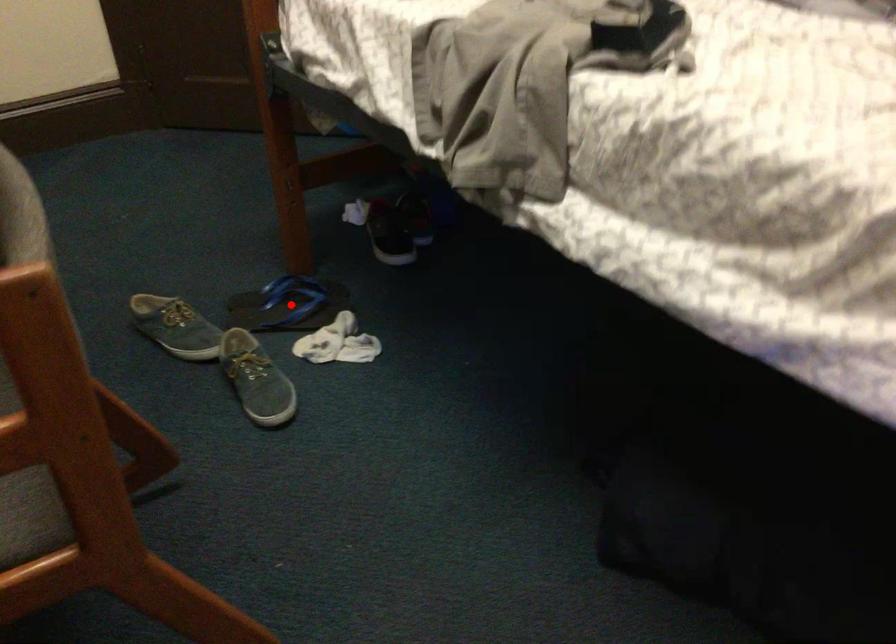
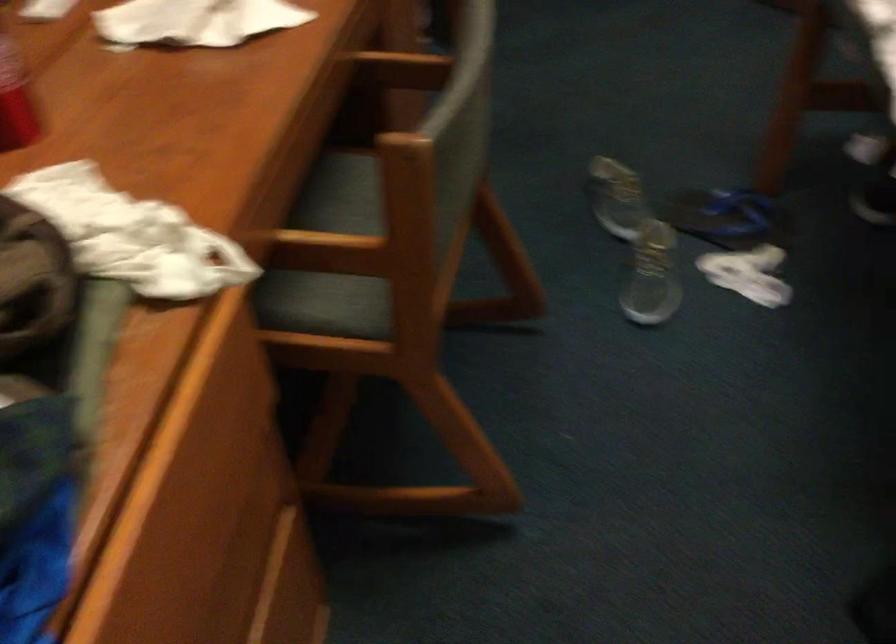
Locate, in the second image, the point that corresponds to the highlighted location in the first image.

(728, 218)